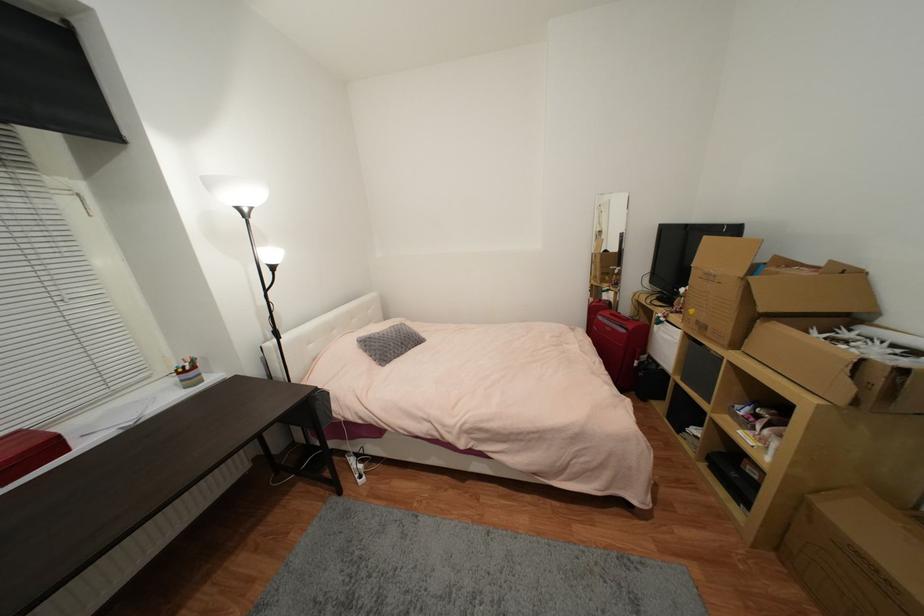
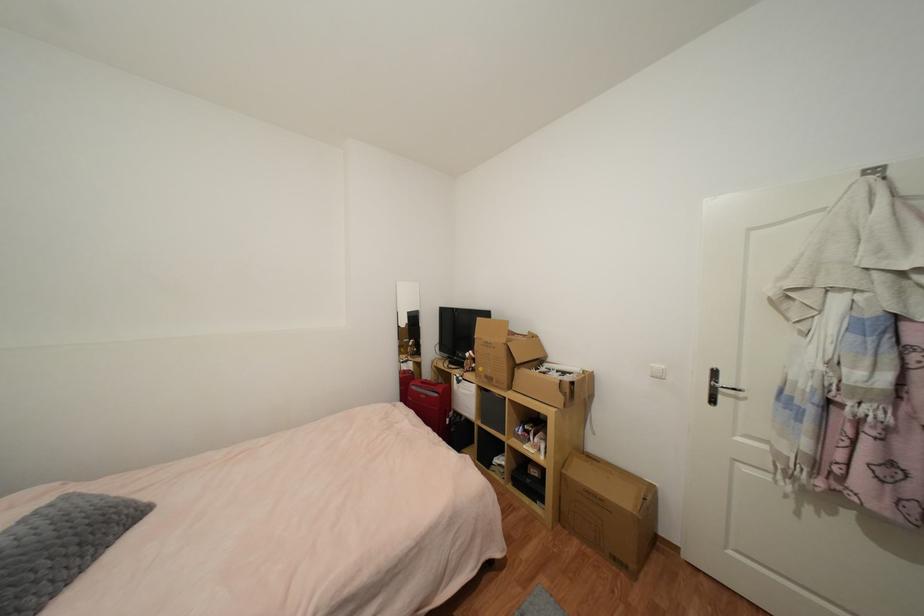
Where in the second image is the point corresponding to (x=782, y=546) from the first image?

(564, 517)